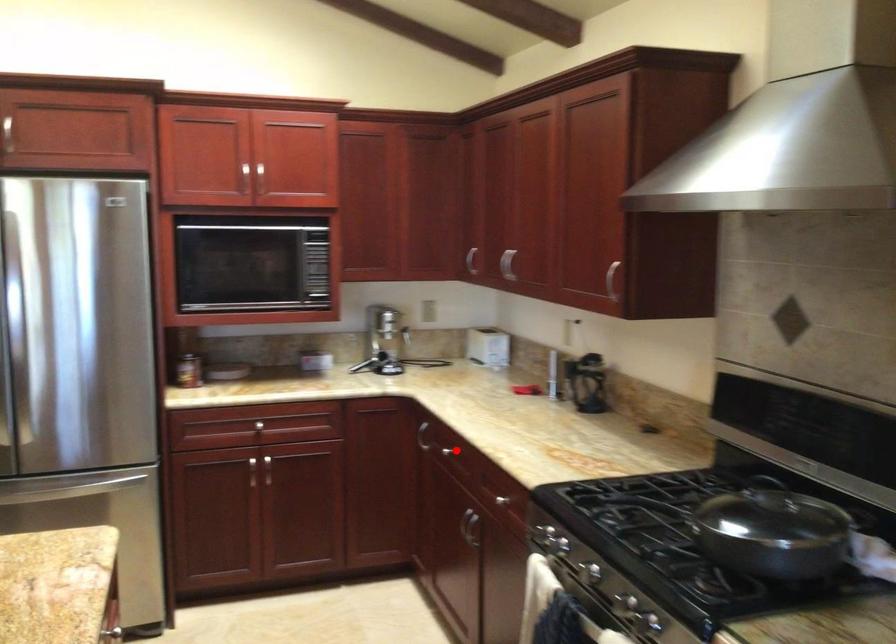
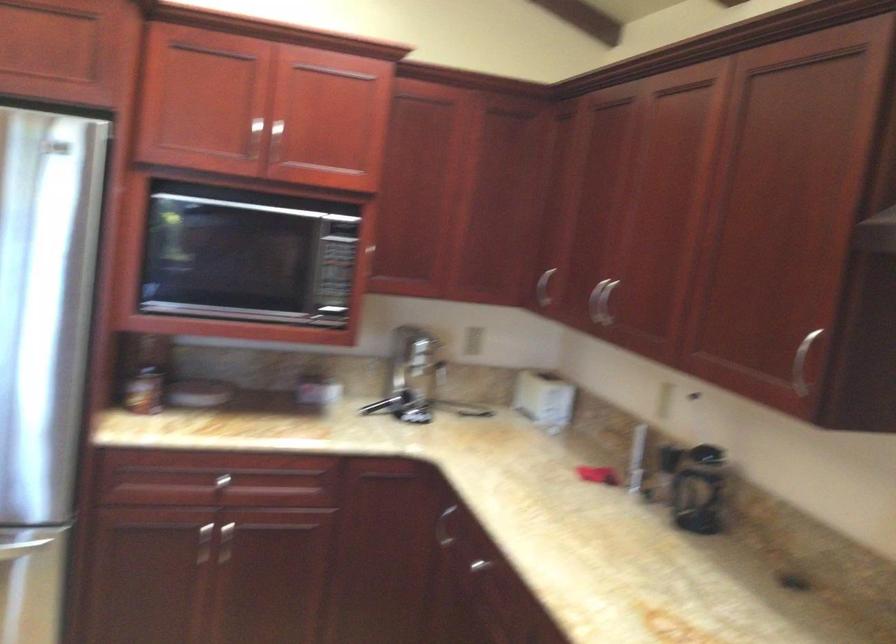
Where in the second image is the point corresponding to the highlighted location from the first image?

(495, 567)